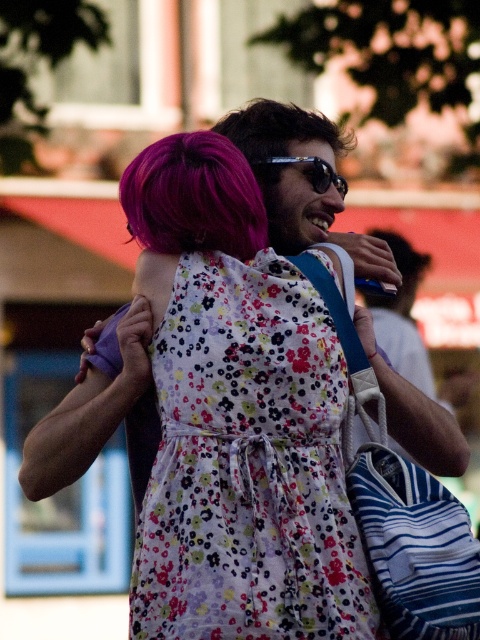
You are standing 30 meters away from a floral cotton dress at center. Can you see the dress clearly from your current position?

The floral cotton dress at center is 29.07 meters away from the viewer, so yes, you can see the dress clearly from your current position since you are only 30 meters away.

You are a photographer trying to capture a closeup of the floral cotton dress at center and the purple matte hair at upper right in the scene. Since you want both objects to appear equally prominent in the photo, which object should you zoom in on more?

The floral cotton dress at center is smaller in size compared to the purple matte hair at upper right. To make both appear equally prominent, you should zoom in more on the floral cotton dress at center to enlarge its appearance in the photo.

You are a photographer trying to capture a closeup of the floral cotton dress at center without the purple matte hair at upper right blocking the view. Is this possible based on their current positions?

The floral cotton dress at center is in front of the purple matte hair at upper right, so it would block the view of the dress. Therefore, you cannot capture a closeup of the floral cotton dress at center without the purple matte hair at upper right blocking the view.